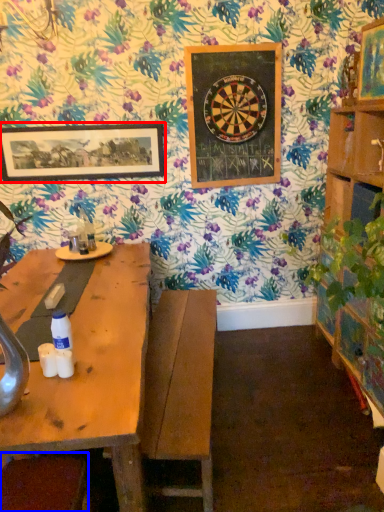
Question: Which point is further to the camera, picture frame (highlighted by a red box) or swivel chair (highlighted by a blue box)?

Choices:
 (A) picture frame
 (B) swivel chair

Answer: (A)